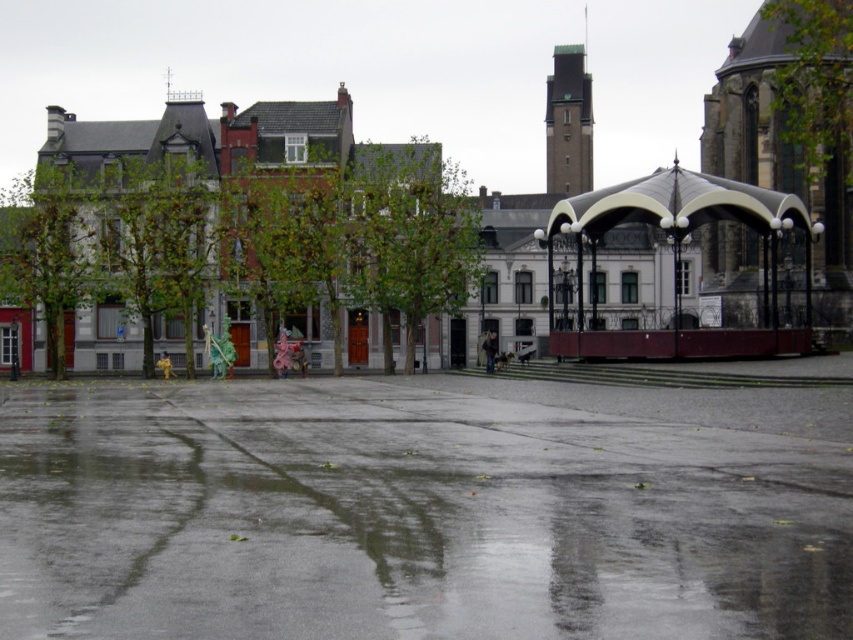
Question: Is glossy concrete puddle at center closer to the viewer compared to metallic silver canopy at center right?

Choices:
 (A) yes
 (B) no

Answer: (A)

Question: Which of the following is the farthest from the observer?

Choices:
 (A) (395, 400)
 (B) (770, 240)

Answer: (B)

Question: Among these objects, which one is farthest from the camera?

Choices:
 (A) metallic silver canopy at center right
 (B) glossy concrete puddle at center

Answer: (A)

Question: Can you confirm if glossy concrete puddle at center is positioned above metallic silver canopy at center right?

Choices:
 (A) no
 (B) yes

Answer: (A)

Question: Is glossy concrete puddle at center in front of metallic silver canopy at center right?

Choices:
 (A) no
 (B) yes

Answer: (B)